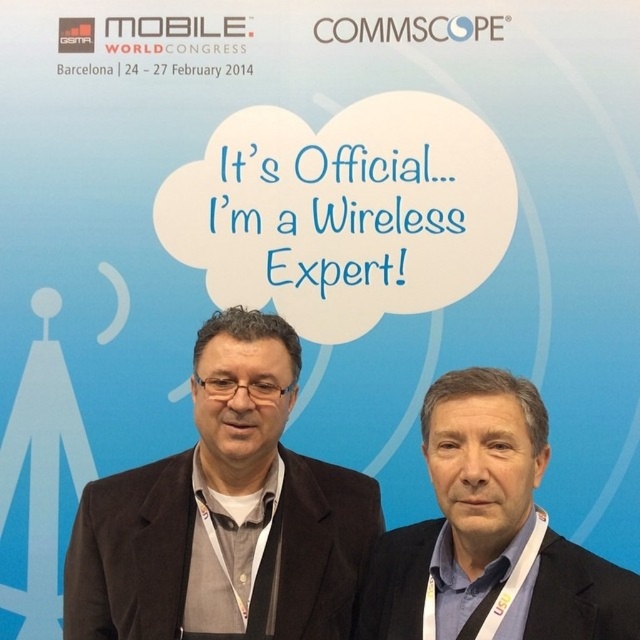
Who is taller, matte black suit at center or dark blue suit at center?

With more height is matte black suit at center.

Does point (312, 579) come in front of point (577, 612)?

No, (312, 579) is further to viewer.

Is point (100, 608) closer to viewer compared to point (513, 461)?

No, it is not.

Identify the location of matte black suit at center. The height and width of the screenshot is (640, 640). (224, 513).